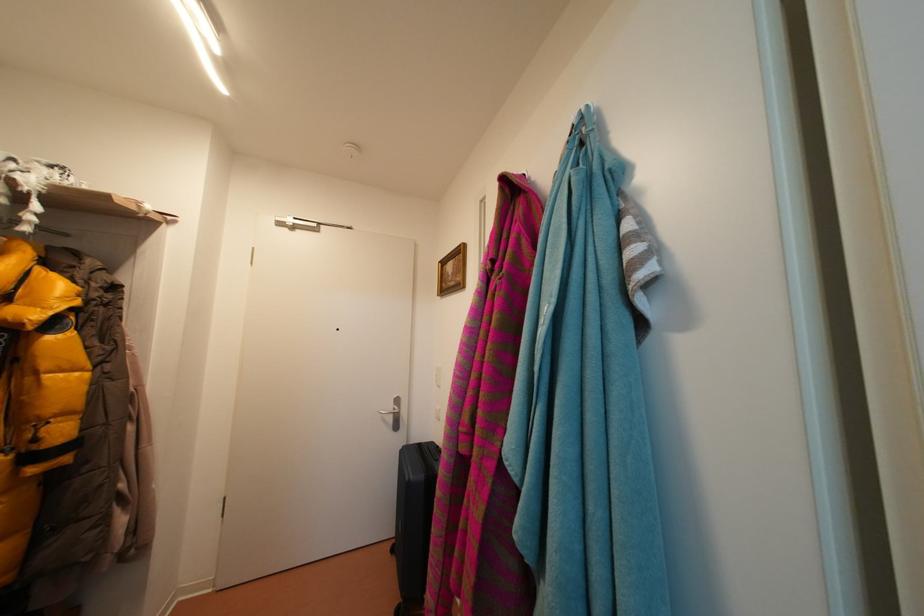
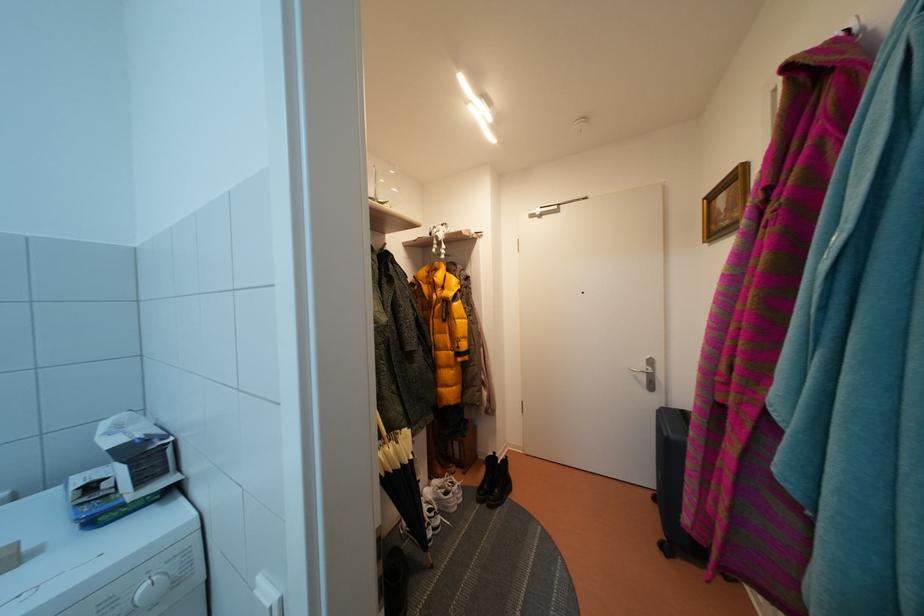
Find the pixel in the second image that matches pixel 399 556 in the first image.

(662, 505)